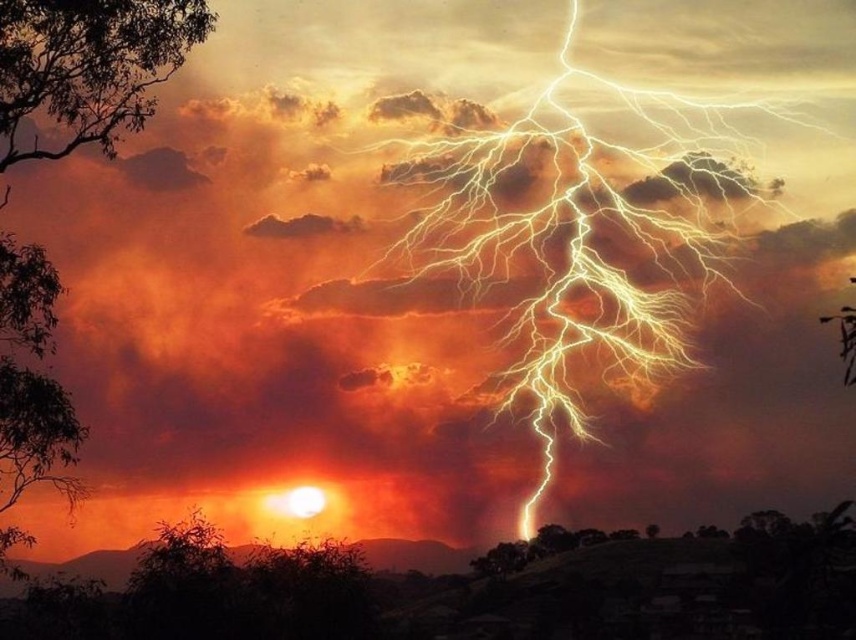
Is point (107, 67) closer to viewer compared to point (79, 422)?

Yes.

Can you confirm if green leafy tree at upper left is thinner than green leafy tree at left?

In fact, green leafy tree at upper left might be wider than green leafy tree at left.

At what (x,y) coordinates should I click in order to perform the action: click on green leafy tree at upper left. Please return your answer as a coordinate pair (x, y). Looking at the image, I should click on (88, 67).

Is silhouette bark tree at left below green leafy tree at upper left?

Correct, silhouette bark tree at left is located below green leafy tree at upper left.

This screenshot has height=640, width=856. What do you see at coordinates (88, 67) in the screenshot? I see `silhouette bark tree at left` at bounding box center [88, 67].

Locate an element on the screen. silhouette bark tree at left is located at coordinates (88, 67).

Locate an element on the screen. This screenshot has height=640, width=856. silhouette bark tree at left is located at coordinates (88, 67).

Is point (201, 28) closer to viewer compared to point (10, 371)?

Yes, point (201, 28) is in front of point (10, 371).

Identify the location of silhouette bark tree at left. (88, 67).